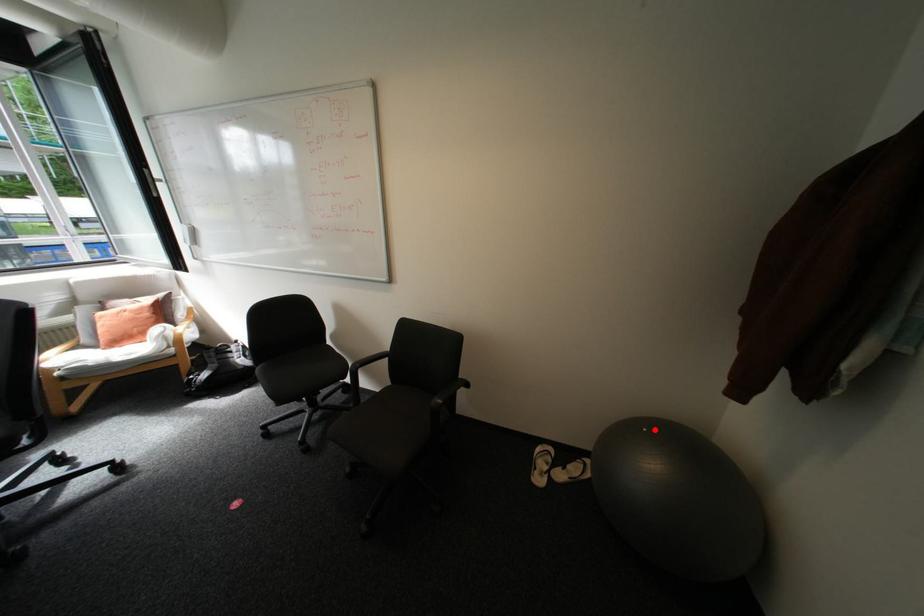
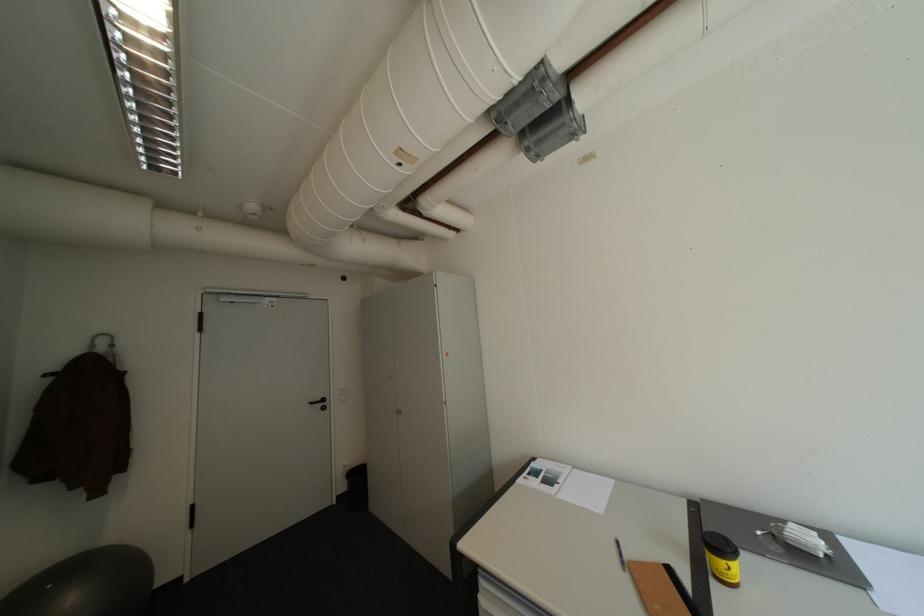
Question: I am providing you with two images of the same scene from different viewpoints. Given a red point in image1, look at the same physical point in image2. Is it:

Choices:
 (A) Closer to the viewpoint
 (B) Farther from the viewpoint

Answer: (B)